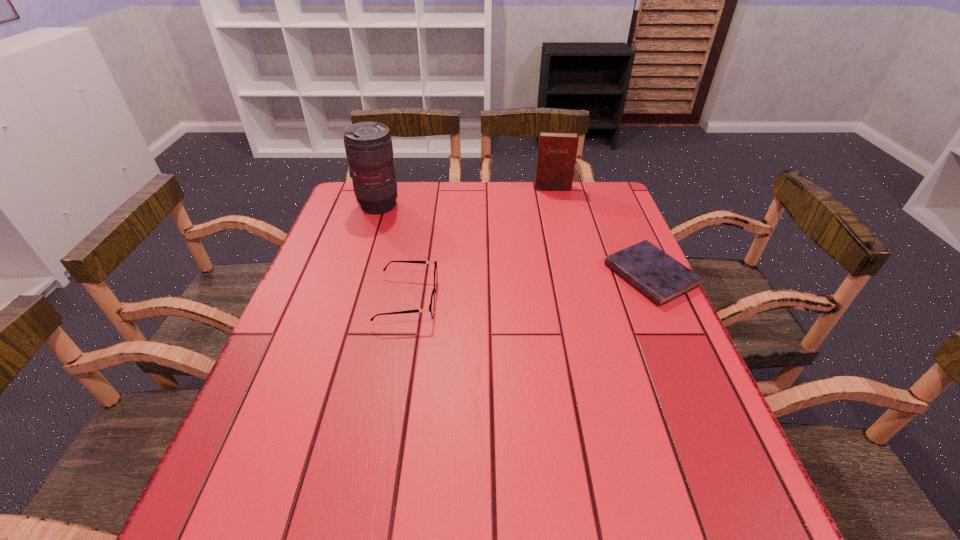
In order to click on free space located on the front cover of the taller diary in this screenshot , I will do `click(556, 241)`.

I want to click on vacant space located on the front cover of the taller diary, so click(x=553, y=204).

Locate an element on the screen. The height and width of the screenshot is (540, 960). free space located 0.380m on the front cover of the taller diary is located at coordinates (557, 262).

I want to click on free space located 0.380m on the side of the tallest object where the control switches are located, so click(482, 266).

What are the coordinates of `vacant space located 0.280m on the side of the tallest object where the control switches are located` in the screenshot? It's located at (456, 251).

In order to click on blank space located 0.330m on the side of the tallest object where the control switches are located in this screenshot , I will do `click(468, 258)`.

The image size is (960, 540). I want to click on diary at the far edge, so click(557, 151).

The height and width of the screenshot is (540, 960). I want to click on telephoto lens that is positioned at the far edge, so click(368, 145).

At what (x,y) coordinates should I click in order to perform the action: click on object positioned at the left edge. Please return your answer as a coordinate pair (x, y). The width and height of the screenshot is (960, 540). Looking at the image, I should click on (368, 145).

The width and height of the screenshot is (960, 540). Identify the location of object located at the far left corner. (368, 145).